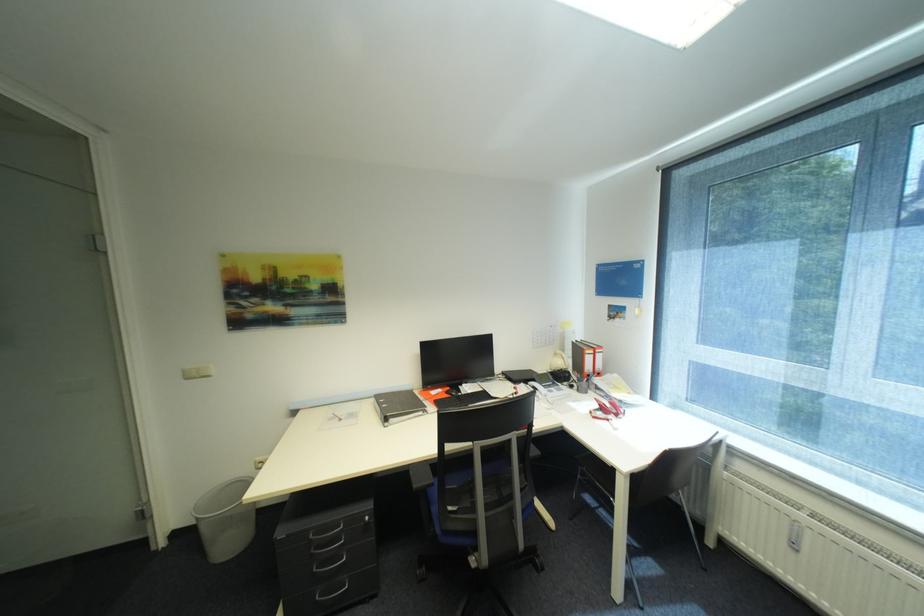
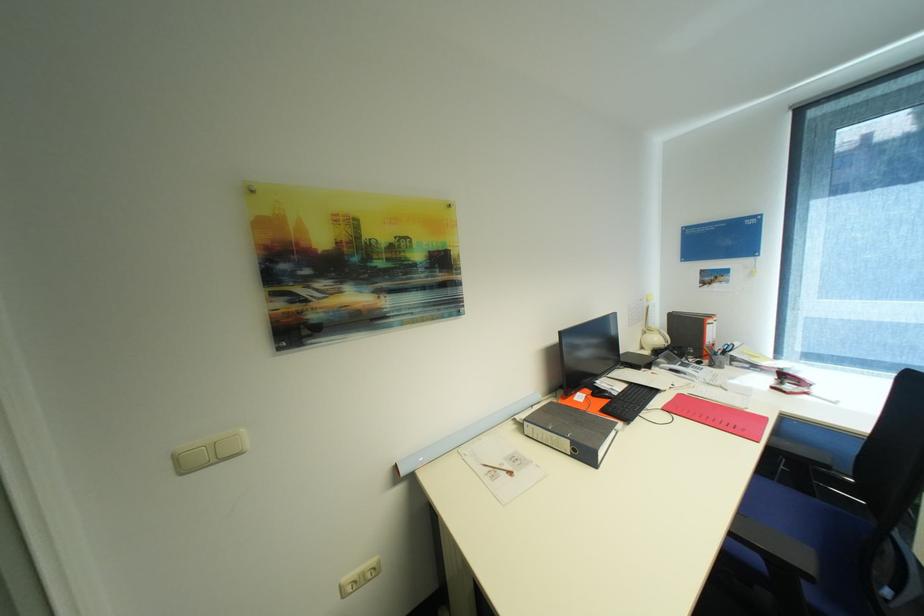
In the second image, find the point that corresponds to the point at 436,387 in the first image.

(581, 392)